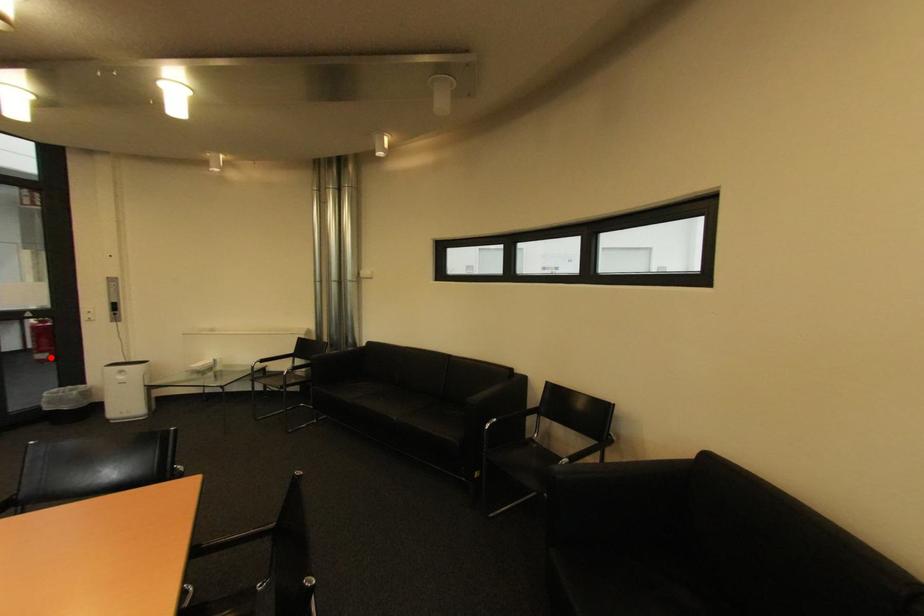
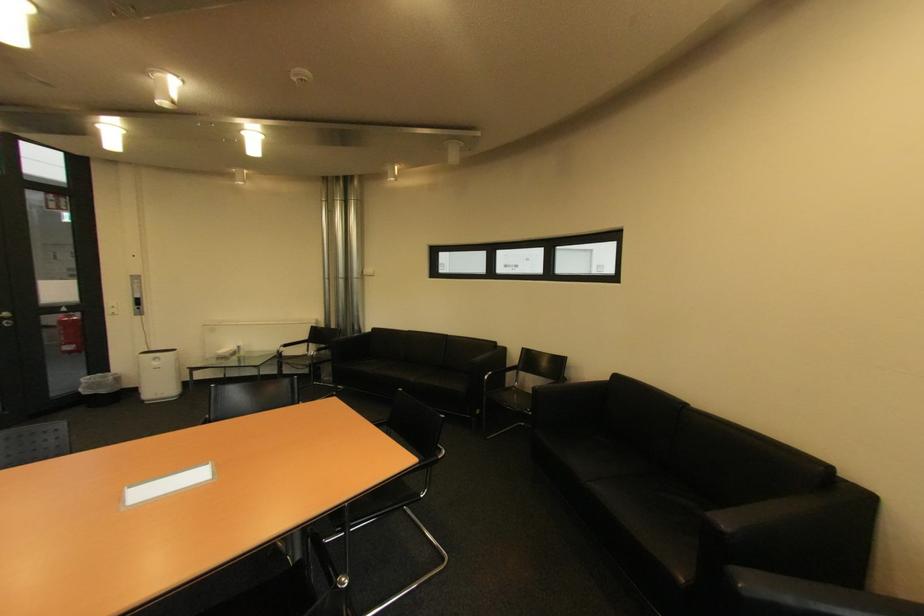
Locate, in the second image, the point that corresponds to the highlighted location in the first image.

(79, 349)